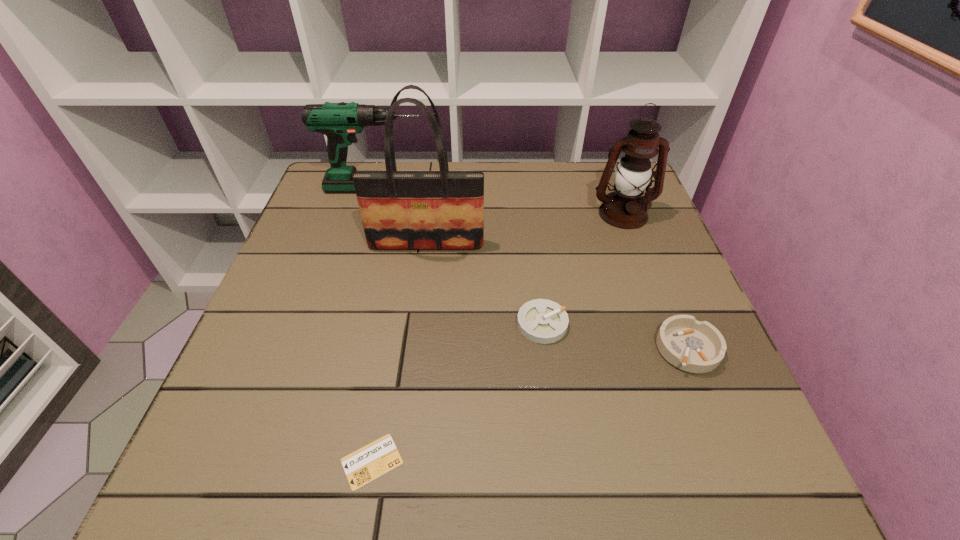
Identify which object is located as the nearest to the shorter ashtray. Please provide its 2D coordinates. Your answer should be formatted as a tuple, i.e. [(x, y)], where the tuple contains the x and y coordinates of a point satisfying the conditions above.

[(698, 347)]

Locate an element on the screen. The image size is (960, 540). free point that satisfies the following two spatial constraints: 1. on the handle side of the drill; 2. on the back side of the third shortest object is located at coordinates (327, 348).

Where is `free space that satisfies the following two spatial constraints: 1. on the back side of the identity card; 2. on the handle side of the fourth shortest object`? The image size is (960, 540). free space that satisfies the following two spatial constraints: 1. on the back side of the identity card; 2. on the handle side of the fourth shortest object is located at coordinates (420, 188).

Find the location of a particular element. Image resolution: width=960 pixels, height=540 pixels. free point that satisfies the following two spatial constraints: 1. on the back side of the second shortest object; 2. on the right side of the nearest object is located at coordinates (396, 323).

Find the location of a particular element. This screenshot has width=960, height=540. free space that satisfies the following two spatial constraints: 1. on the front-facing side of the second shortest object; 2. on the left side of the third farthest object is located at coordinates (416, 323).

Where is `free location that satisfies the following two spatial constraints: 1. on the handle side of the left ashtray; 2. on the left side of the third tallest object`? Image resolution: width=960 pixels, height=540 pixels. free location that satisfies the following two spatial constraints: 1. on the handle side of the left ashtray; 2. on the left side of the third tallest object is located at coordinates (335, 323).

The height and width of the screenshot is (540, 960). Find the location of `free space that satisfies the following two spatial constraints: 1. on the side of the fifth shortest object, there is a wick adjustment knob; 2. on the right side of the taller ashtray`. free space that satisfies the following two spatial constraints: 1. on the side of the fifth shortest object, there is a wick adjustment knob; 2. on the right side of the taller ashtray is located at coordinates (674, 348).

This screenshot has height=540, width=960. I want to click on free spot that satisfies the following two spatial constraints: 1. on the back side of the shortest object; 2. on the handle side of the fourth shortest object, so click(420, 188).

Where is `vacant position in the image that satisfies the following two spatial constraints: 1. on the handle side of the right ashtray; 2. on the right side of the fourth shortest object`? vacant position in the image that satisfies the following two spatial constraints: 1. on the handle side of the right ashtray; 2. on the right side of the fourth shortest object is located at coordinates (327, 348).